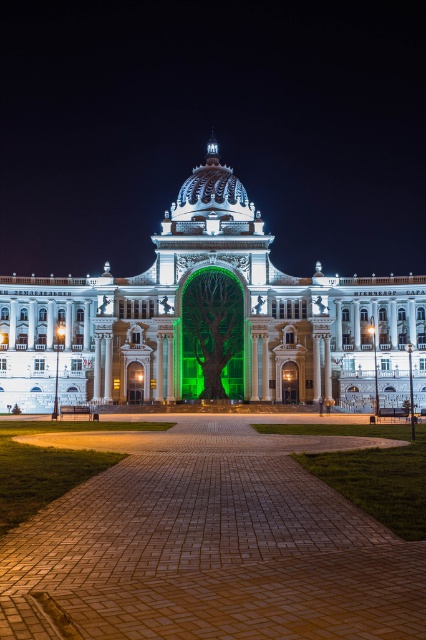
Is brick paved plaza at center to the right of green matte tree at center from the viewer's perspective?

In fact, brick paved plaza at center is to the left of green matte tree at center.

Can you confirm if brick paved plaza at center is positioned to the left of green matte tree at center?

Yes, brick paved plaza at center is to the left of green matte tree at center.

Where is `brick paved plaza at center`? brick paved plaza at center is located at coordinates (210, 545).

Locate an element on the screen. brick paved plaza at center is located at coordinates click(210, 545).

Describe the element at coordinates (210, 321) in the screenshot. I see `white marble palace at center` at that location.

Looking at this image, who is higher up, white marble palace at center or green matte tree at center?

Positioned higher is white marble palace at center.

Between point (192, 278) and point (233, 333), which one is positioned behind?

Point (192, 278)

Locate an element on the screen. The image size is (426, 640). white marble palace at center is located at coordinates (210, 321).

Is point (170, 497) closer to viewer compared to point (58, 300)?

Yes, point (170, 497) is closer to viewer.

Is brick paved plaza at center to the left of white marble palace at center from the viewer's perspective?

Incorrect, brick paved plaza at center is not on the left side of white marble palace at center.

In order to click on brick paved plaza at center in this screenshot , I will do `click(210, 545)`.